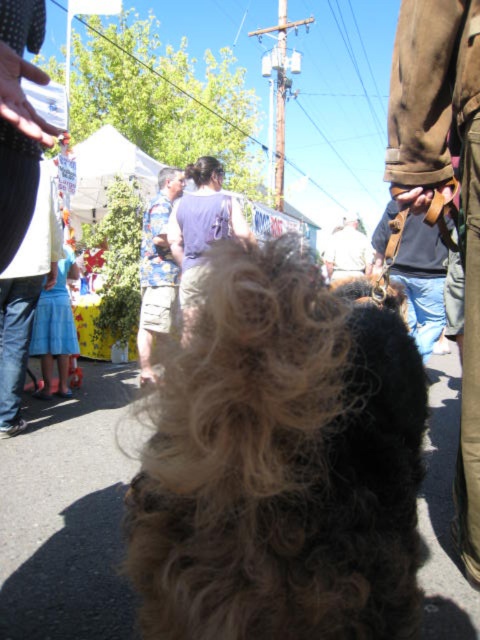
Between brown leather belt at center and dark purple shirt at center, which one appears on the right side from the viewer's perspective?

Positioned to the right is brown leather belt at center.

Based on the photo, does brown leather belt at center have a smaller size compared to dark purple shirt at center?

Incorrect, brown leather belt at center is not smaller in size than dark purple shirt at center.

The width and height of the screenshot is (480, 640). What do you see at coordinates (421, 280) in the screenshot? I see `brown leather belt at center` at bounding box center [421, 280].

Locate an element on the screen. The width and height of the screenshot is (480, 640). brown leather belt at center is located at coordinates (421, 280).

Which is behind, point (44, 244) or point (224, 225)?

The point (224, 225) is more distant.

In the scene shown: Who is positioned more to the left, blue denim skirt at lower left or dark purple shirt at center?

blue denim skirt at lower left is more to the left.

This screenshot has height=640, width=480. What are the coordinates of `blue denim skirt at lower left` in the screenshot? It's located at (25, 298).

Is point (14, 336) farther from camera compared to point (404, 262)?

No, (14, 336) is in front of (404, 262).

Where is `blue denim skirt at lower left`? The width and height of the screenshot is (480, 640). blue denim skirt at lower left is located at coordinates (25, 298).